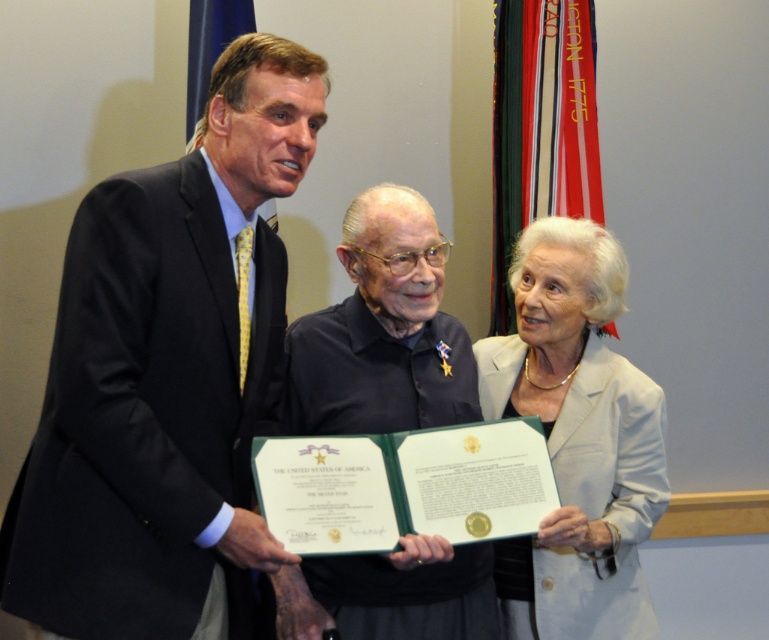
Between point (118, 592) and point (534, 636), which one is positioned behind?

Positioned behind is point (534, 636).

Between point (12, 506) and point (551, 561), which one is positioned behind?

Positioned behind is point (551, 561).

Locate an element on the screen. The width and height of the screenshot is (769, 640). dark suit at center is located at coordinates (167, 376).

Can you confirm if dark suit at center is positioned to the right of black matte shirt at center?

No, dark suit at center is not to the right of black matte shirt at center.

Is dark suit at center wider than black matte shirt at center?

Yes.

Which is in front, point (182, 262) or point (361, 579)?

Point (182, 262) is in front.

Identify the location of dark suit at center. The image size is (769, 640). (167, 376).

Does light beige fabric at center appear on the right side of black matte shirt at center?

Indeed, light beige fabric at center is positioned on the right side of black matte shirt at center.

Does point (641, 456) lie in front of point (368, 600)?

No, it is not.

The image size is (769, 640). What are the coordinates of `light beige fabric at center` in the screenshot? It's located at (576, 438).